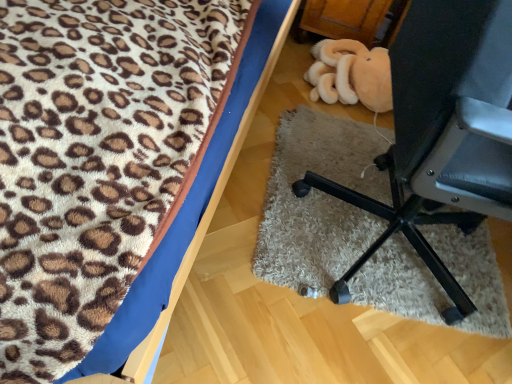
Question: Choose the correct answer: Is leopard print fabric at upper left, the first furniture viewed from the left, inside black plastic chair at lower right, the second furniture positioned from the left, or outside it?

Choices:
 (A) inside
 (B) outside

Answer: (B)

Question: In terms of size, does leopard print fabric at upper left, the first furniture viewed from the left, appear bigger or smaller than black plastic chair at lower right, arranged as the first furniture when viewed from the right?

Choices:
 (A) big
 (B) small

Answer: (A)

Question: From a real-world perspective, relative to black plastic chair at lower right, arranged as the first furniture when viewed from the right, is leopard print fabric at upper left, the second furniture in the right-to-left sequence, vertically above or below?

Choices:
 (A) above
 (B) below

Answer: (B)

Question: Does point (297, 188) appear closer or farther from the camera than point (184, 56)?

Choices:
 (A) closer
 (B) farther

Answer: (B)

Question: In terms of width, does black plastic chair at lower right, the second furniture positioned from the left, look wider or thinner when compared to leopard print fabric at upper left, the second furniture in the right-to-left sequence?

Choices:
 (A) thin
 (B) wide

Answer: (A)

Question: Would you say black plastic chair at lower right, the second furniture positioned from the left, is inside or outside leopard print fabric at upper left, the second furniture in the right-to-left sequence?

Choices:
 (A) outside
 (B) inside

Answer: (A)

Question: Is black plastic chair at lower right, arranged as the first furniture when viewed from the right, bigger or smaller than leopard print fabric at upper left, the first furniture viewed from the left?

Choices:
 (A) small
 (B) big

Answer: (A)